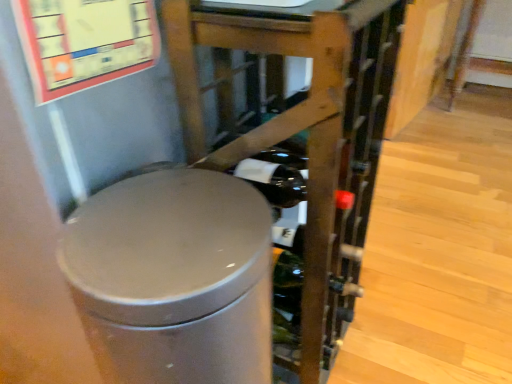
Question: Choose the correct answer: Is satin silver trash can at center inside matte gray trash can at center or outside it?

Choices:
 (A) outside
 (B) inside

Answer: (A)

Question: Considering the positions of satin silver trash can at center and matte gray trash can at center in the image, is satin silver trash can at center taller or shorter than matte gray trash can at center?

Choices:
 (A) tall
 (B) short

Answer: (B)

Question: Based on their positions, is satin silver trash can at center located to the left or right of matte gray trash can at center?

Choices:
 (A) right
 (B) left

Answer: (B)

Question: Looking at the image, does matte gray trash can at center seem bigger or smaller compared to satin silver trash can at center?

Choices:
 (A) small
 (B) big

Answer: (B)

Question: Is matte gray trash can at center taller or shorter than satin silver trash can at center?

Choices:
 (A) short
 (B) tall

Answer: (B)

Question: From the image's perspective, is matte gray trash can at center located above or below satin silver trash can at center?

Choices:
 (A) below
 (B) above

Answer: (B)

Question: From a real-world perspective, is matte gray trash can at center positioned above or below satin silver trash can at center?

Choices:
 (A) below
 (B) above

Answer: (B)